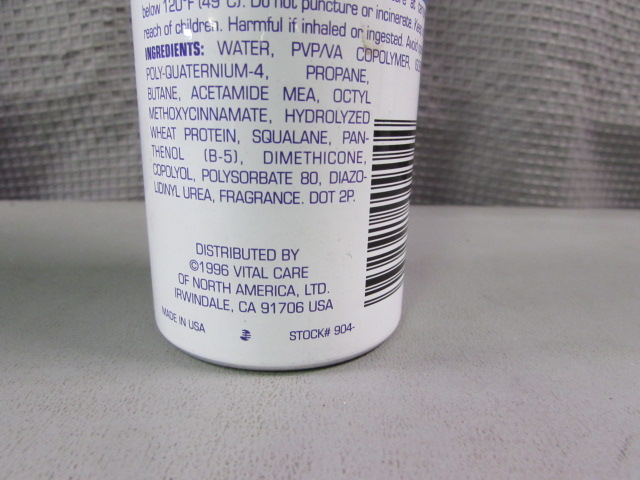
You are a GUI agent. You are given a task and a screenshot of the screen. Output one action in this format:
    pyautogui.click(x=<x>, y=<y>)
    Task: Click on the table top
    
    Given the screenshot: What is the action you would take?
    pyautogui.click(x=456, y=250)